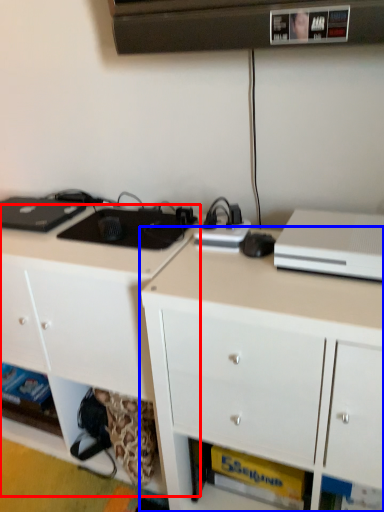
Question: Which object is further to the camera taking this photo, cabinetry (highlighted by a red box) or cabinetry (highlighted by a blue box)?

Choices:
 (A) cabinetry
 (B) cabinetry

Answer: (A)